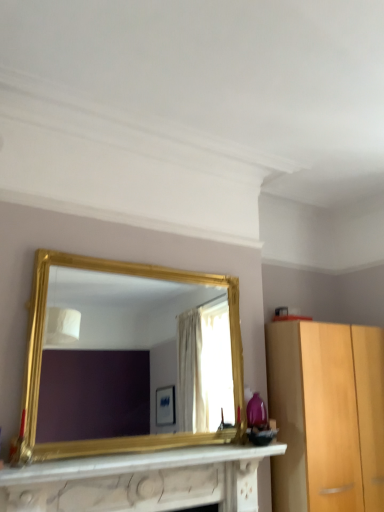
Question: Does gold/gilded mirror at center touch white marble fireplace at lower center?

Choices:
 (A) no
 (B) yes

Answer: (A)

Question: Is gold/gilded mirror at center aimed at white marble fireplace at lower center?

Choices:
 (A) no
 (B) yes

Answer: (A)

Question: Is gold/gilded mirror at center wider than white marble fireplace at lower center?

Choices:
 (A) yes
 (B) no

Answer: (B)

Question: Is gold/gilded mirror at center positioned with its back to white marble fireplace at lower center?

Choices:
 (A) no
 (B) yes

Answer: (A)

Question: From a real-world perspective, is gold/gilded mirror at center physically above white marble fireplace at lower center?

Choices:
 (A) no
 (B) yes

Answer: (B)

Question: From the image's perspective, does gold/gilded mirror at center appear higher than white marble fireplace at lower center?

Choices:
 (A) yes
 (B) no

Answer: (A)

Question: Does white marble fireplace at lower center have a greater height compared to gold/gilded mirror at center?

Choices:
 (A) yes
 (B) no

Answer: (B)

Question: Considering the relative positions of white marble fireplace at lower center and gold/gilded mirror at center in the image provided, is white marble fireplace at lower center to the right of gold/gilded mirror at center from the viewer's perspective?

Choices:
 (A) yes
 (B) no

Answer: (B)

Question: From the image's perspective, would you say white marble fireplace at lower center is shown under gold/gilded mirror at center?

Choices:
 (A) yes
 (B) no

Answer: (A)

Question: Can you confirm if white marble fireplace at lower center is bigger than gold/gilded mirror at center?

Choices:
 (A) no
 (B) yes

Answer: (A)

Question: Is the depth of white marble fireplace at lower center less than that of gold/gilded mirror at center?

Choices:
 (A) yes
 (B) no

Answer: (A)

Question: From the image's perspective, would you say white marble fireplace at lower center is positioned over gold/gilded mirror at center?

Choices:
 (A) yes
 (B) no

Answer: (B)

Question: In terms of size, does white marble fireplace at lower center appear bigger or smaller than gold/gilded mirror at center?

Choices:
 (A) small
 (B) big

Answer: (A)